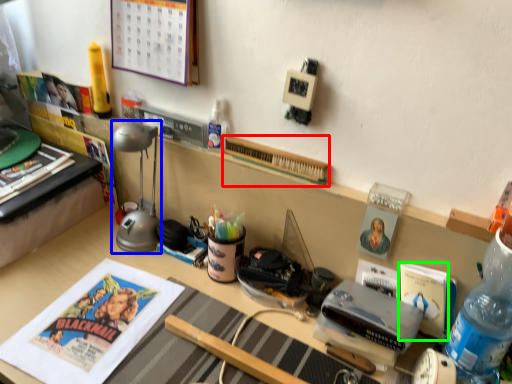
Question: Which object is positioned farthest from book (highlighted by a red box)? Select from table lamp (highlighted by a blue box) and paperback book (highlighted by a green box).

Choices:
 (A) table lamp
 (B) paperback book

Answer: (B)